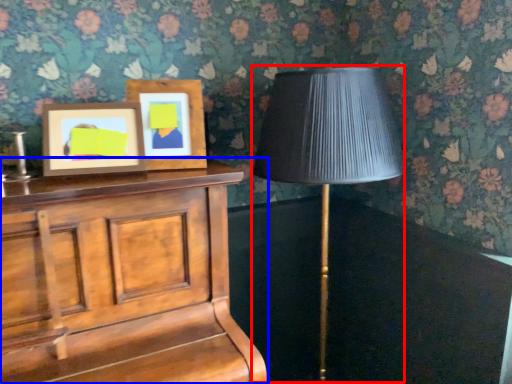
Question: Which of the following is the farthest to the observer, table lamp (highlighted by a red box) or furniture (highlighted by a blue box)?

Choices:
 (A) table lamp
 (B) furniture

Answer: (A)